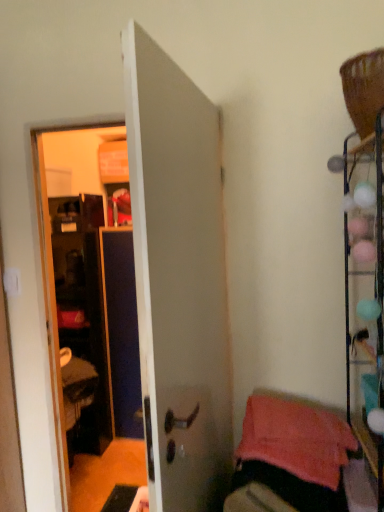
Question: Is pink soft towel at lower right in front of or behind metallic wire rack at right in the image?

Choices:
 (A) behind
 (B) front

Answer: (A)

Question: From the image's perspective, is pink soft towel at lower right positioned above or below metallic wire rack at right?

Choices:
 (A) above
 (B) below

Answer: (B)

Question: Which is farther from the white matte door at center?

Choices:
 (A) pink soft towel at lower right
 (B) metallic wire rack at right

Answer: (B)

Question: Which is farther from the pink soft towel at lower right?

Choices:
 (A) white matte door at center
 (B) metallic wire rack at right

Answer: (A)